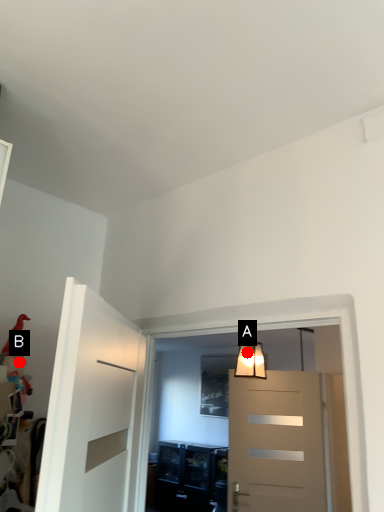
Question: Two points are circled on the image, labeled by A and B beside each circle. Which point is closer to the camera?

Choices:
 (A) A is closer
 (B) B is closer

Answer: (B)